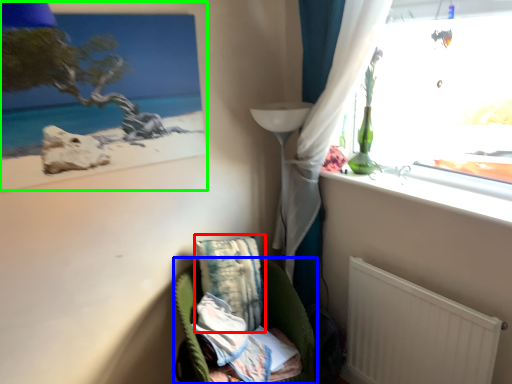
Question: Which is nearer to the pillow (highlighted by a red box)? furniture (highlighted by a blue box) or picture frame (highlighted by a green box).

Choices:
 (A) furniture
 (B) picture frame

Answer: (A)